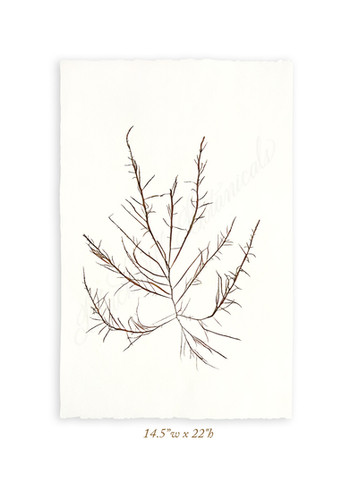
Locate an element on the screen. The height and width of the screenshot is (490, 349). painting is located at coordinates (88, 360).